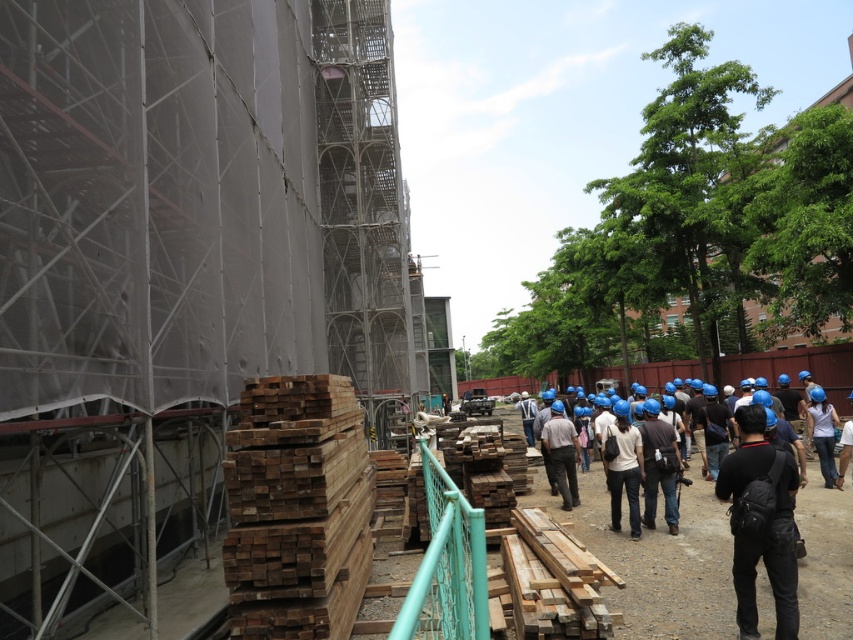
You are a construction worker who needs to move a heavy tool from the weathered wood at lower left to the dark gray fabric camera bag at center. Considering their widths, will the tool fit on the camera bag if it was previously placed on the weathered wood?

The weathered wood at lower left is wider than the dark gray fabric camera bag at center. Since the tool was placed on the wider surface, it may not fit on the narrower camera bag unless it is smaller than the bag.